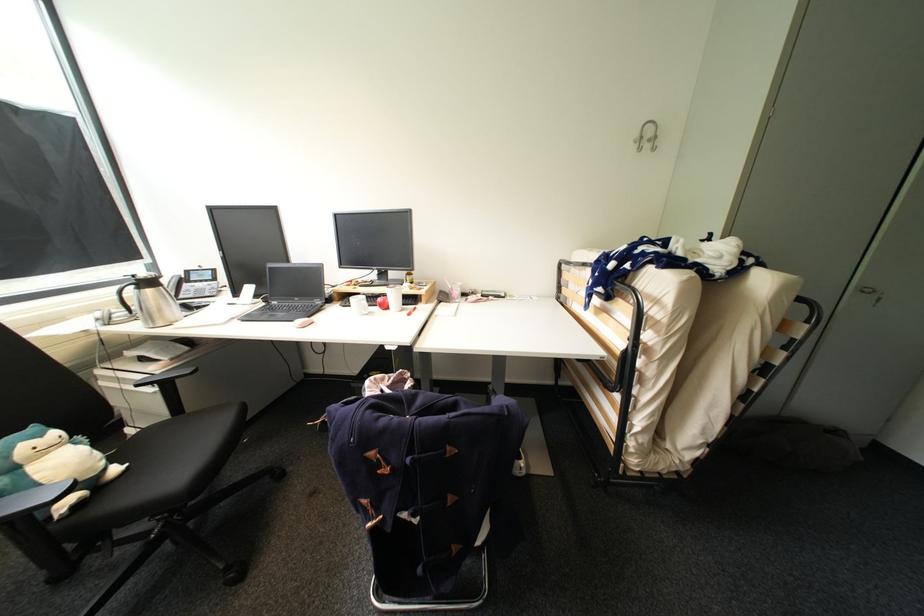
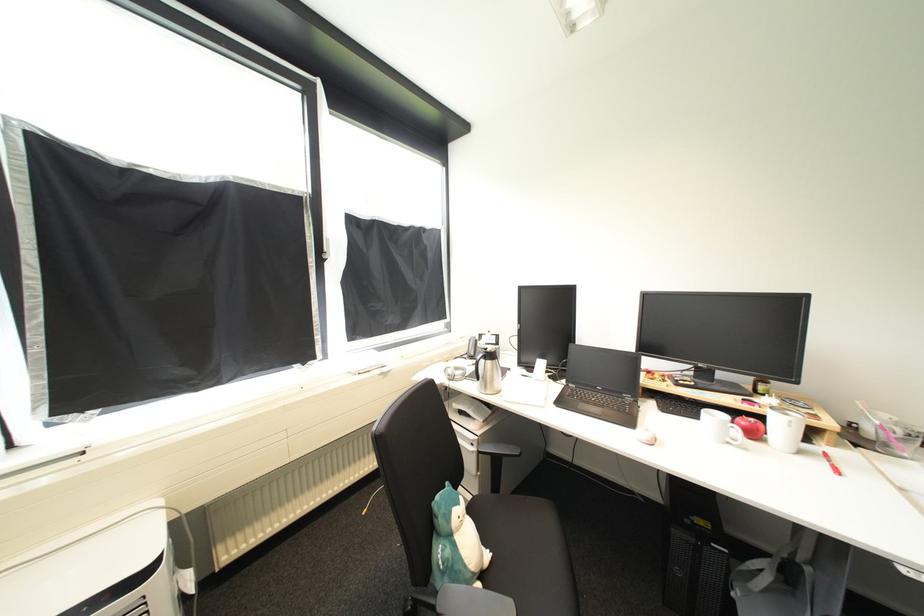
Locate, in the second image, the point that corresponds to point (124, 469) in the first image.

(493, 557)